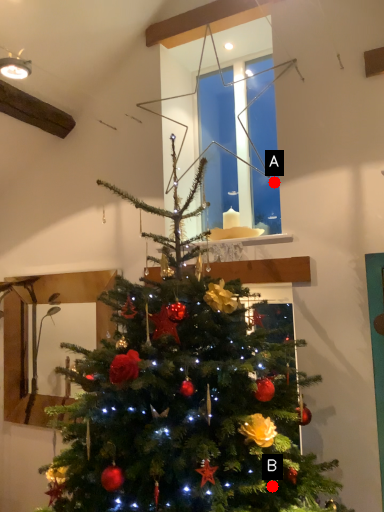
Question: Two points are circled on the image, labeled by A and B beside each circle. Which point is farther to the camera?

Choices:
 (A) A is further
 (B) B is further

Answer: (A)